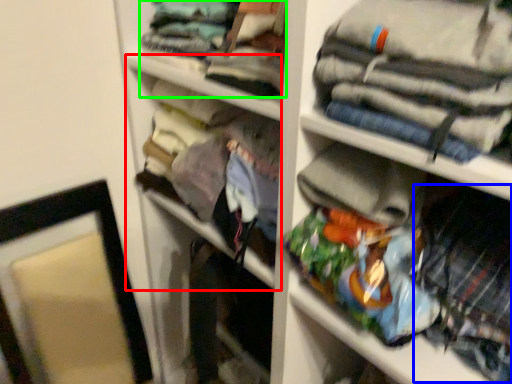
Question: Considering the real-world distances, which object is farthest from cabinet (highlighted by a red box)? clothing (highlighted by a blue box) or clothing (highlighted by a green box)?

Choices:
 (A) clothing
 (B) clothing

Answer: (A)